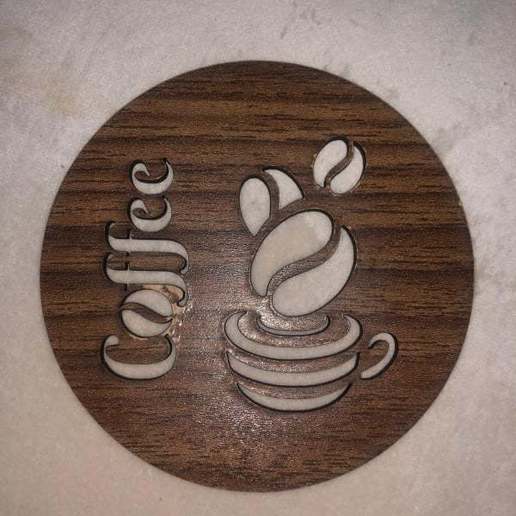
Where is `coffee mug base`? coffee mug base is located at coordinates (56, 76), (287, 403).